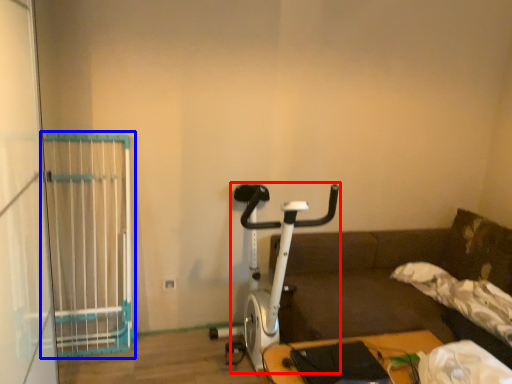
Question: Which object appears closest to the camera in this image, stationary bicycle (highlighted by a red box) or cage (highlighted by a blue box)?

Choices:
 (A) stationary bicycle
 (B) cage

Answer: (A)